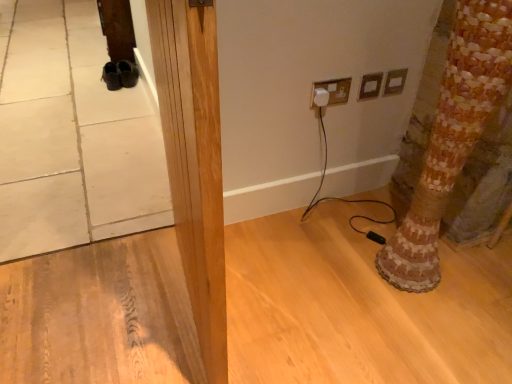
You are a GUI agent. You are given a task and a screenshot of the screen. Output one action in this format:
    pyautogui.click(x=<x>, y=<y>)
    Task: Click on the vacant area located to the right-hand side of wooden mosaic tree trunk at lower right
    
    Given the screenshot: What is the action you would take?
    pyautogui.click(x=473, y=277)